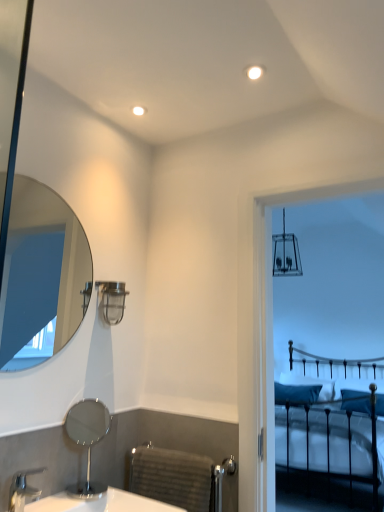
Where is `silver metallic faucet at lower left`? The image size is (384, 512). silver metallic faucet at lower left is located at coordinates (22, 489).

This screenshot has width=384, height=512. I want to click on white glossy sink at lower left, so click(x=101, y=503).

Where is `gray textured towel rack at lower center`? The height and width of the screenshot is (512, 384). gray textured towel rack at lower center is located at coordinates (173, 477).

Where is `blue fabric pillow at right, placed as the second pillow when sorted from left to right`? blue fabric pillow at right, placed as the second pillow when sorted from left to right is located at coordinates (356, 401).

Where is `silver metallic faucet at lower left`? The image size is (384, 512). silver metallic faucet at lower left is located at coordinates (22, 489).

Does point (7, 243) come closer to viewer compared to point (375, 368)?

Yes, it is in front of point (375, 368).

Considering the sizes of objects clear glass mirror at upper left, the 2th mirror when ordered from bottom to top, and black metal bed at upper right in the image provided, who is bigger, clear glass mirror at upper left, the 2th mirror when ordered from bottom to top, or black metal bed at upper right?

With larger size is black metal bed at upper right.

From their relative heights in the image, would you say clear glass mirror at upper left, the 2th mirror when ordered from bottom to top, is taller or shorter than black metal bed at upper right?

Considering their sizes, clear glass mirror at upper left, the 2th mirror when ordered from bottom to top, has less height than black metal bed at upper right.

From a real-world perspective, which is physically below, clear glass mirror at upper left, the 2th mirror when ordered from bottom to top, or black metal bed at upper right?

black metal bed at upper right.

Considering the sizes of clear glass mirror at upper left, the 2th mirror when ordered from bottom to top, and polished chrome mirror at lower left, placed as the 1th mirror when sorted from bottom to top, in the image, is clear glass mirror at upper left, the 2th mirror when ordered from bottom to top, taller or shorter than polished chrome mirror at lower left, placed as the 1th mirror when sorted from bottom to top,?

Considering their sizes, clear glass mirror at upper left, the 2th mirror when ordered from bottom to top, has more height than polished chrome mirror at lower left, placed as the 1th mirror when sorted from bottom to top.

Is point (34, 250) positioned behind point (79, 434)?

Yes, point (34, 250) is farther from viewer.

Could you tell me if clear glass mirror at upper left, the 2th mirror when ordered from bottom to top, is facing polished chrome mirror at lower left, placed as the 1th mirror when sorted from bottom to top?

No, clear glass mirror at upper left, the 2th mirror when ordered from bottom to top, is not turned towards polished chrome mirror at lower left, placed as the 1th mirror when sorted from bottom to top.

From the image's perspective, which is below, clear glass mirror at upper left, the 2th mirror when ordered from bottom to top, or polished chrome mirror at lower left, the second mirror viewed from the top?

polished chrome mirror at lower left, the second mirror viewed from the top, appears lower in the image.

Measure the distance between silver metallic faucet at lower left and polished chrome mirror at lower left, placed as the 1th mirror when sorted from bottom to top.

silver metallic faucet at lower left is 22.38 centimeters from polished chrome mirror at lower left, placed as the 1th mirror when sorted from bottom to top.

Is point (22, 497) closer or farther from the camera than point (92, 413)?

Point (22, 497) is positioned closer to the camera compared to point (92, 413).

From a real-world perspective, which is physically above, silver metallic faucet at lower left or polished chrome mirror at lower left, the second mirror viewed from the top?

From a 3D spatial view, polished chrome mirror at lower left, the second mirror viewed from the top, is above.

Who is smaller, silver metallic faucet at lower left or polished chrome mirror at lower left, the second mirror viewed from the top?

silver metallic faucet at lower left is smaller.

Are black metal bed at upper right and polished chrome mirror at lower left, the second mirror viewed from the top, far apart?

That's right, there is a large distance between black metal bed at upper right and polished chrome mirror at lower left, the second mirror viewed from the top.

In terms of size, does black metal bed at upper right appear bigger or smaller than polished chrome mirror at lower left, the second mirror viewed from the top?

In the image, black metal bed at upper right appears to be larger than polished chrome mirror at lower left, the second mirror viewed from the top.

From a real-world perspective, which is physically above, black metal bed at upper right or polished chrome mirror at lower left, the second mirror viewed from the top?

From a 3D spatial view, polished chrome mirror at lower left, the second mirror viewed from the top, is above.

Does black metal bed at upper right turn towards polished chrome mirror at lower left, placed as the 1th mirror when sorted from bottom to top?

Yes, black metal bed at upper right is facing polished chrome mirror at lower left, placed as the 1th mirror when sorted from bottom to top.

Does gray textured towel rack at lower center have a greater width compared to metallic industrial light fixture at upper center?

No.

Is gray textured towel rack at lower center not near metallic industrial light fixture at upper center?

That's not correct — gray textured towel rack at lower center is a little close to metallic industrial light fixture at upper center.

Is point (174, 463) closer to camera compared to point (115, 309)?

That is True.

Where is `radiator that is below the metallic industrial light fixture at upper center (from the image's perspective)`? radiator that is below the metallic industrial light fixture at upper center (from the image's perspective) is located at coordinates (173, 477).

Considering the positions of objects silver metallic faucet at lower left and clear glass mirror at upper left, arranged as the first mirror when viewed from the top, in the image provided, who is more to the right, silver metallic faucet at lower left or clear glass mirror at upper left, arranged as the first mirror when viewed from the top,?

Positioned to the right is silver metallic faucet at lower left.

Who is bigger, silver metallic faucet at lower left or clear glass mirror at upper left, arranged as the first mirror when viewed from the top?

Bigger between the two is clear glass mirror at upper left, arranged as the first mirror when viewed from the top.

Is clear glass mirror at upper left, arranged as the first mirror when viewed from the top, at the back of silver metallic faucet at lower left?

No, silver metallic faucet at lower left is not facing away from clear glass mirror at upper left, arranged as the first mirror when viewed from the top.

Image resolution: width=384 pixels, height=512 pixels. Identify the location of the 2nd mirror directly above the silver metallic faucet at lower left (from a real-world perspective). (42, 276).

How many degrees apart are the facing directions of black metal bed at upper right and clear glass mirror at upper left, arranged as the first mirror when viewed from the top?

87.6 degrees separate the facing orientations of black metal bed at upper right and clear glass mirror at upper left, arranged as the first mirror when viewed from the top.

From the image's perspective, is black metal bed at upper right located above clear glass mirror at upper left, arranged as the first mirror when viewed from the top?

No.

Does black metal bed at upper right turn towards clear glass mirror at upper left, the 2th mirror when ordered from bottom to top?

Yes.

Based on the photo, considering the relative sizes of black metal bed at upper right and clear glass mirror at upper left, the 2th mirror when ordered from bottom to top, in the image provided, is black metal bed at upper right wider than clear glass mirror at upper left, the 2th mirror when ordered from bottom to top,?

Yes, black metal bed at upper right is wider than clear glass mirror at upper left, the 2th mirror when ordered from bottom to top.

Identify the location of mirror that is the 2nd one when counting upward from the black metal bed at upper right (from the image's perspective). (42, 276).

Where is `mirror above the polished chrome mirror at lower left, the second mirror viewed from the top (from a real-world perspective)`? mirror above the polished chrome mirror at lower left, the second mirror viewed from the top (from a real-world perspective) is located at coordinates (42, 276).

Estimate the real-world distances between objects in this image. Which object is further from polished chrome mirror at lower left, placed as the 1th mirror when sorted from bottom to top, blue fabric pillow at right, placed as the second pillow when sorted from left to right, or white glossy sink at lower left?

blue fabric pillow at right, placed as the second pillow when sorted from left to right, is further to polished chrome mirror at lower left, placed as the 1th mirror when sorted from bottom to top.

Consider the image. Which object lies further to the anchor point white glossy sink at lower left, metallic industrial light fixture at upper center or black metal bed at upper right?

black metal bed at upper right is further to white glossy sink at lower left.

Looking at this image, from the image, which object appears to be farther from teal fabric pillow at center, the first pillow from the left, clear glass mirror at upper left, the 2th mirror when ordered from bottom to top, or silver metallic faucet at lower left?

silver metallic faucet at lower left lies further to teal fabric pillow at center, the first pillow from the left, than the other object.

Looking at the image, which one is located further to metallic industrial light fixture at upper center, clear glass mirror at upper left, the 2th mirror when ordered from bottom to top, or teal fabric pillow at center, the first pillow from the left?

The object further to metallic industrial light fixture at upper center is teal fabric pillow at center, the first pillow from the left.

When comparing their distances from clear glass mirror at upper left, the 2th mirror when ordered from bottom to top, does silver metallic faucet at lower left or teal fabric pillow at center, the 2th pillow from the right, seem closer?

silver metallic faucet at lower left is closer to clear glass mirror at upper left, the 2th mirror when ordered from bottom to top.

When comparing their distances from blue fabric pillow at right, acting as the first pillow starting from the right, does teal fabric pillow at center, the first pillow from the left, or white glossy sink at lower left seem closer?

teal fabric pillow at center, the first pillow from the left, is positioned closer to the anchor blue fabric pillow at right, acting as the first pillow starting from the right.

Estimate the real-world distances between objects in this image. Which object is closer to silver metallic faucet at lower left, teal fabric pillow at center, the 2th pillow from the right, or black metal bed at upper right?

Based on the image, black metal bed at upper right appears to be nearer to silver metallic faucet at lower left.

From the image, which object appears to be nearer to metallic industrial light fixture at upper center, silver metallic faucet at lower left or teal fabric pillow at center, the 2th pillow from the right?

Among the two, silver metallic faucet at lower left is located nearer to metallic industrial light fixture at upper center.

Image resolution: width=384 pixels, height=512 pixels. What are the coordinates of `lamp between gray textured towel rack at lower center and teal fabric pillow at center, the first pillow from the left, along the z-axis` in the screenshot? It's located at (112, 300).

Where is `tap situated between clear glass mirror at upper left, arranged as the first mirror when viewed from the top, and black metal bed at upper right from left to right`? The image size is (384, 512). tap situated between clear glass mirror at upper left, arranged as the first mirror when viewed from the top, and black metal bed at upper right from left to right is located at coordinates (22, 489).

At what (x,y) coordinates should I click in order to perform the action: click on lamp located between polished chrome mirror at lower left, placed as the 1th mirror when sorted from bottom to top, and blue fabric pillow at right, acting as the first pillow starting from the right, in the depth direction. Please return your answer as a coordinate pair (x, y). Image resolution: width=384 pixels, height=512 pixels. Looking at the image, I should click on (112, 300).

Where is `counter top between silver metallic faucet at lower left and black metal bed at upper right from left to right`? counter top between silver metallic faucet at lower left and black metal bed at upper right from left to right is located at coordinates (101, 503).